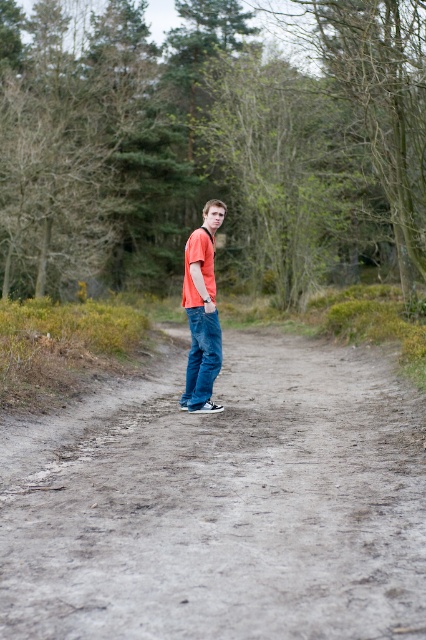
Between point (66, 509) and point (39, 161), which one is positioned behind?

The point (39, 161) is more distant.

Between point (299, 416) and point (411, 289), which one is positioned in front?

Point (299, 416) is more forward.

Between point (307, 499) and point (412, 288), which one is positioned behind?

Point (412, 288)

At what (x,y) coordinates should I click in order to perform the action: click on dull gray dirt track at center. Please return your answer as a coordinate pair (x, y). This screenshot has width=426, height=640. Looking at the image, I should click on (221, 504).

Who is positioned more to the right, dull gray dirt track at center or matte orange t-shirt at center?

dull gray dirt track at center is more to the right.

Is point (114, 616) closer to viewer compared to point (189, 273)?

Yes, it is in front of point (189, 273).

Describe the element at coordinates (221, 504) in the screenshot. The width and height of the screenshot is (426, 640). I see `dull gray dirt track at center` at that location.

Find the location of `dull gray dirt track at center`. dull gray dirt track at center is located at coordinates (221, 504).

Is green leafy trees at center to the right of matte orange t-shirt at center from the viewer's perspective?

Indeed, green leafy trees at center is positioned on the right side of matte orange t-shirt at center.

Between green leafy trees at center and matte orange t-shirt at center, which one appears on the right side from the viewer's perspective?

green leafy trees at center

Locate an element on the screen. This screenshot has width=426, height=640. green leafy trees at center is located at coordinates (210, 145).